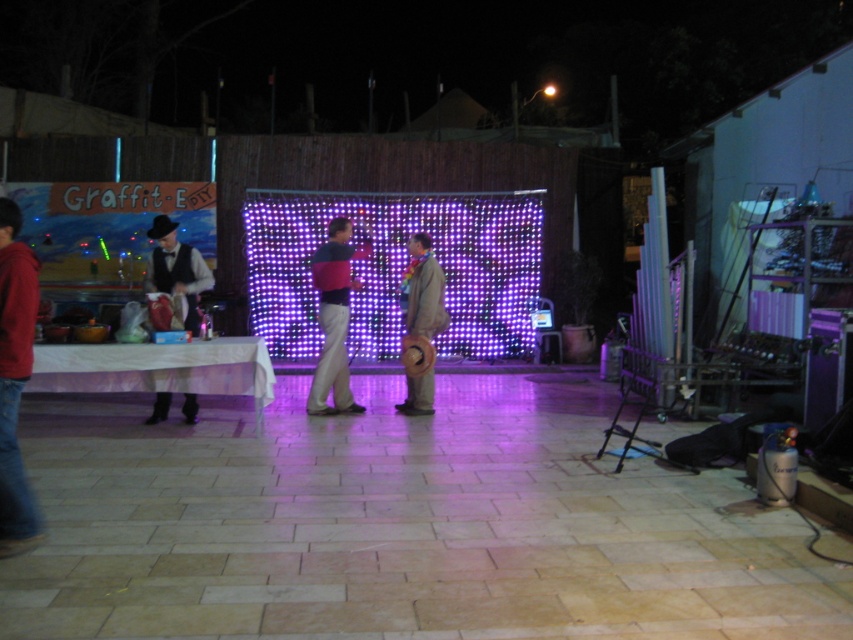
Can you confirm if smooth stone floor at center is positioned above matte pink sweater at center?

Actually, smooth stone floor at center is below matte pink sweater at center.

Does smooth stone floor at center have a greater height compared to matte pink sweater at center?

In fact, smooth stone floor at center may be shorter than matte pink sweater at center.

Locate an element on the screen. The image size is (853, 640). smooth stone floor at center is located at coordinates (397, 524).

Is point (144, 284) positioned behind point (416, 320)?

No, (144, 284) is in front of (416, 320).

The width and height of the screenshot is (853, 640). Find the location of `matte black vest at left`. matte black vest at left is located at coordinates (177, 269).

At what (x,y) coordinates should I click in order to perform the action: click on matte black vest at left. Please return your answer as a coordinate pair (x, y). Looking at the image, I should click on (177, 269).

Does red hoodie at left have a smaller size compared to matte black vest at left?

Indeed, red hoodie at left has a smaller size compared to matte black vest at left.

Does red hoodie at left have a lesser height compared to matte black vest at left?

No.

Consider the image. Who is more forward, (x=16, y=493) or (x=167, y=230)?

Point (x=16, y=493) is more forward.

Image resolution: width=853 pixels, height=640 pixels. I want to click on red hoodie at left, so click(15, 380).